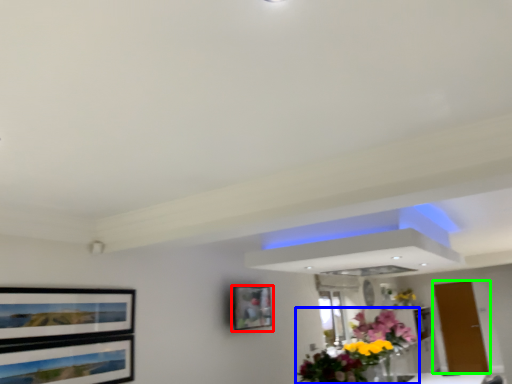
Question: Which object is positioned closest to picture frame (highlighted by a red box)? Select from flower (highlighted by a blue box) and door (highlighted by a green box).

Choices:
 (A) flower
 (B) door

Answer: (A)